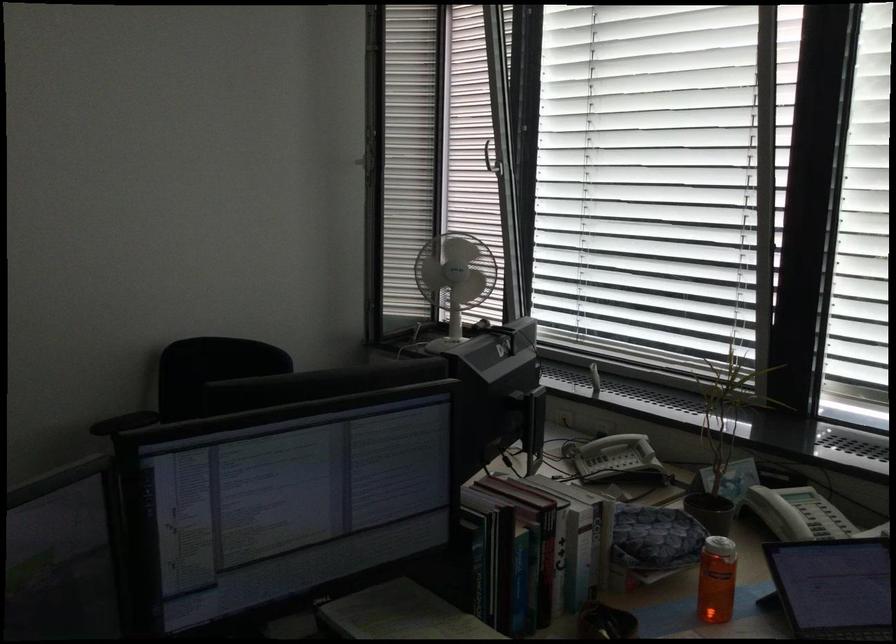
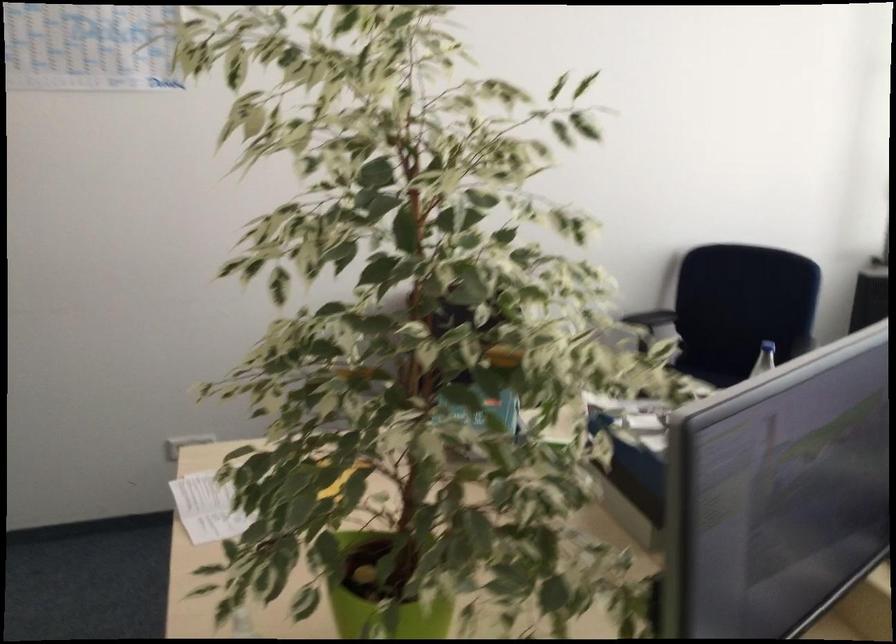
Which direction would the cameraman need to move to produce the second image?

The cameraman walked toward left, backward.